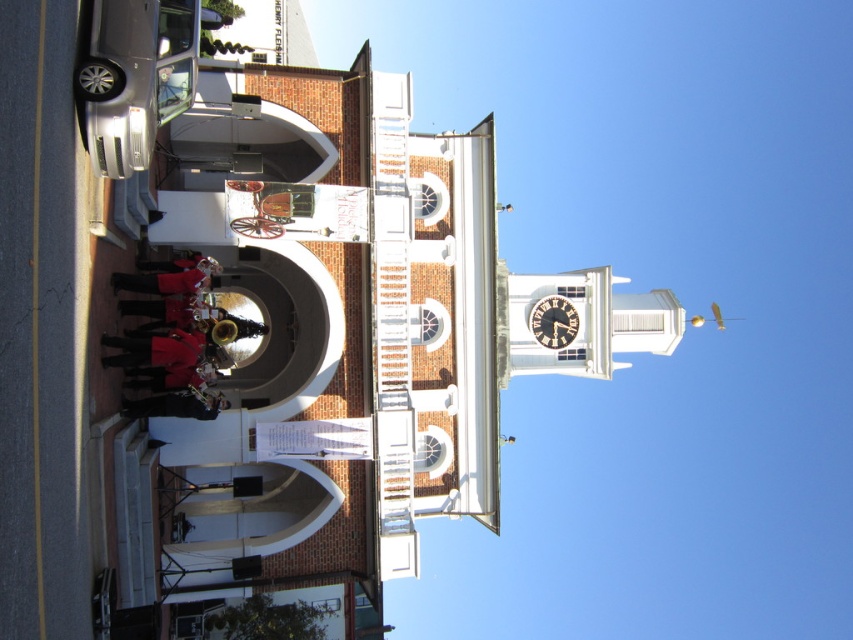
Is satin silver sedan at left thinner than wooden clock at upper center?

No, satin silver sedan at left is not thinner than wooden clock at upper center.

Between satin silver sedan at left and wooden clock at upper center, which one appears on the left side from the viewer's perspective?

Positioned to the left is satin silver sedan at left.

Which is in front, point (163, 49) or point (556, 304)?

Point (163, 49) is more forward.

Identify the location of satin silver sedan at left. The width and height of the screenshot is (853, 640). (137, 76).